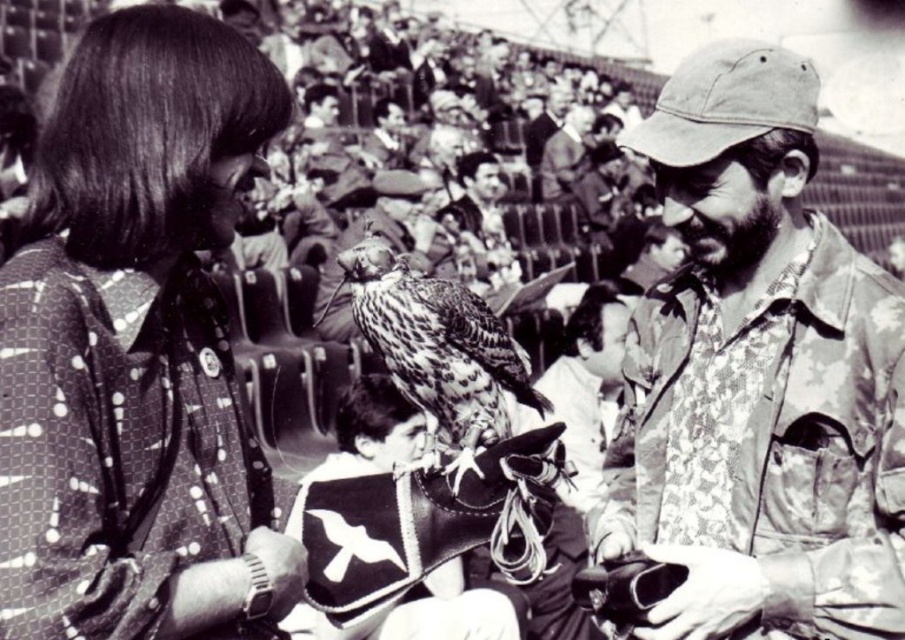
Is point (81, 412) closer to viewer compared to point (429, 627)?

Yes, point (81, 412) is in front of point (429, 627).

Between polka dot fabric shirt at upper left and leather vest at center, which one has more height?

With more height is polka dot fabric shirt at upper left.

Is point (227, 100) positioned behind point (424, 580)?

That is False.

Locate an element on the screen. This screenshot has height=640, width=905. polka dot fabric shirt at upper left is located at coordinates (137, 349).

Who is more forward, (746, 458) or (356, 445)?

Point (746, 458)

Describe the element at coordinates (758, 376) in the screenshot. I see `floral-patterned shirt at center` at that location.

Locate an element on the screen. The height and width of the screenshot is (640, 905). floral-patterned shirt at center is located at coordinates (758, 376).

Is speckled feathers falcon at center closer to camera compared to leather vest at center?

That is False.

Who is taller, speckled feathers falcon at center or leather vest at center?

leather vest at center

Does point (388, 257) come behind point (359, 634)?

No, (388, 257) is closer to viewer.

Where is `speckled feathers falcon at center`? speckled feathers falcon at center is located at coordinates (436, 346).